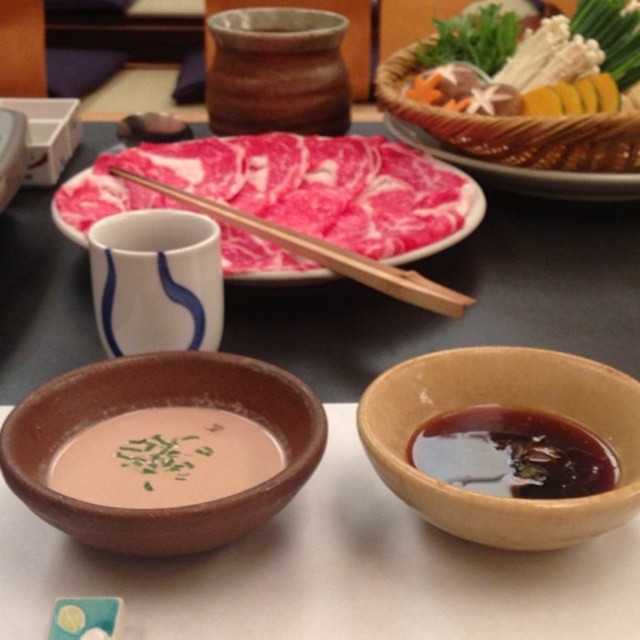
The image size is (640, 640). Describe the element at coordinates (164, 458) in the screenshot. I see `matte brown bowl at center` at that location.

Is point (93, 428) more distant than point (572, 461)?

Yes, point (93, 428) is behind point (572, 461).

At what (x,y) coordinates should I click in order to perform the action: click on matte brown bowl at center. Please return your answer as a coordinate pair (x, y). Image resolution: width=640 pixels, height=640 pixels. Looking at the image, I should click on (164, 458).

Is point (208, 512) closer to viewer compared to point (579, 80)?

Yes, point (208, 512) is in front of point (579, 80).

You are a GUI agent. You are given a task and a screenshot of the screen. Output one action in this format:
    pyautogui.click(x=<x>, y=<y>)
    Task: Click on the brown clay bowl at lower left
    The height and width of the screenshot is (640, 640).
    Given the screenshot: What is the action you would take?
    pyautogui.click(x=156, y=404)

Between dark brown glossy bowl at lower right and wooden chopsticks at center, which one is positioned higher?

wooden chopsticks at center

Can you confirm if dark brown glossy bowl at lower right is smaller than wooden chopsticks at center?

Yes, dark brown glossy bowl at lower right is smaller than wooden chopsticks at center.

Between point (508, 484) and point (224, 216), which one is positioned behind?

Positioned behind is point (224, 216).

Where is `dark brown glossy bowl at lower right`? This screenshot has height=640, width=640. dark brown glossy bowl at lower right is located at coordinates (513, 454).